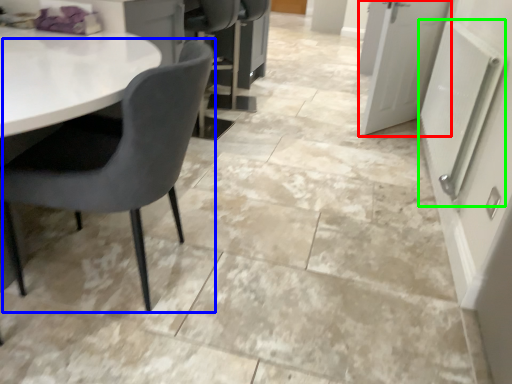
Question: Based on their relative distances, which object is nearer to door (highlighted by a red box)? Choose from chair (highlighted by a blue box) and radiator (highlighted by a green box).

Choices:
 (A) chair
 (B) radiator

Answer: (B)